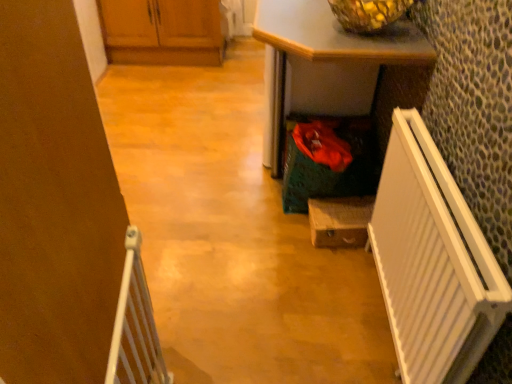
This screenshot has height=384, width=512. What are the coordinates of `vacant area that lies between wooden drawer at center, marked as the 2th cabinetry in a left-to-right arrangement, and white plastic radiator at right, acting as the first radiator starting from the right` in the screenshot? It's located at (343, 295).